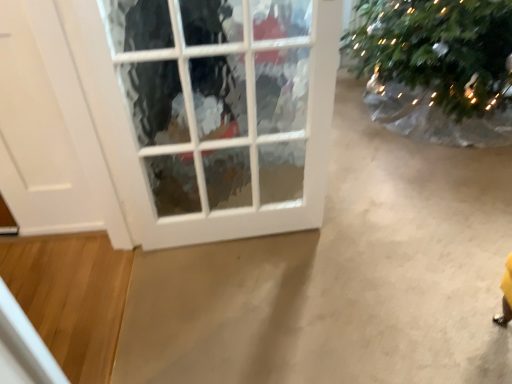
Question: Considering the relative sizes of white glass window at center and white matte door at left in the image provided, is white glass window at center bigger than white matte door at left?

Choices:
 (A) yes
 (B) no

Answer: (A)

Question: Considering the relative sizes of white glass window at center and white matte door at left in the image provided, is white glass window at center thinner than white matte door at left?

Choices:
 (A) no
 (B) yes

Answer: (A)

Question: From the image's perspective, is white glass window at center located above white matte door at left?

Choices:
 (A) no
 (B) yes

Answer: (A)

Question: Could you tell me if white glass window at center is facing white matte door at left?

Choices:
 (A) yes
 (B) no

Answer: (B)

Question: Would you say white glass window at center is a long distance from white matte door at left?

Choices:
 (A) yes
 (B) no

Answer: (B)

Question: From a real-world perspective, is white glass window at center positioned over white matte door at left based on gravity?

Choices:
 (A) yes
 (B) no

Answer: (A)

Question: Considering the relative sizes of white matte door at left and green textured christmas tree at upper right in the image provided, is white matte door at left thinner than green textured christmas tree at upper right?

Choices:
 (A) no
 (B) yes

Answer: (B)

Question: From the image's perspective, does white matte door at left appear lower than green textured christmas tree at upper right?

Choices:
 (A) no
 (B) yes

Answer: (B)

Question: Is white matte door at left smaller than green textured christmas tree at upper right?

Choices:
 (A) no
 (B) yes

Answer: (B)

Question: From the image's perspective, is white matte door at left on green textured christmas tree at upper right?

Choices:
 (A) yes
 (B) no

Answer: (B)

Question: Can you confirm if white matte door at left is bigger than green textured christmas tree at upper right?

Choices:
 (A) yes
 (B) no

Answer: (B)

Question: Is white matte door at left positioned with its back to green textured christmas tree at upper right?

Choices:
 (A) yes
 (B) no

Answer: (B)

Question: Considering the relative sizes of white glass window at center and green textured christmas tree at upper right in the image provided, is white glass window at center bigger than green textured christmas tree at upper right?

Choices:
 (A) no
 (B) yes

Answer: (B)